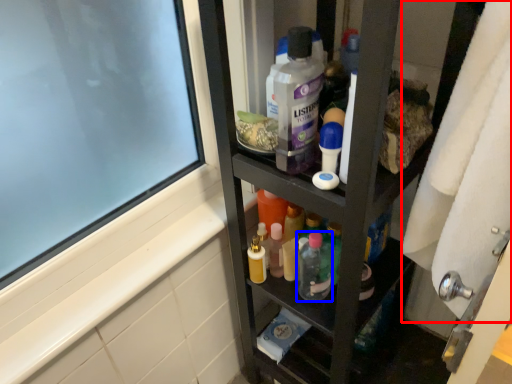
Question: Which of the following is the closest to the observer, bath towel (highlighted by a red box) or toiletry (highlighted by a blue box)?

Choices:
 (A) bath towel
 (B) toiletry

Answer: (A)